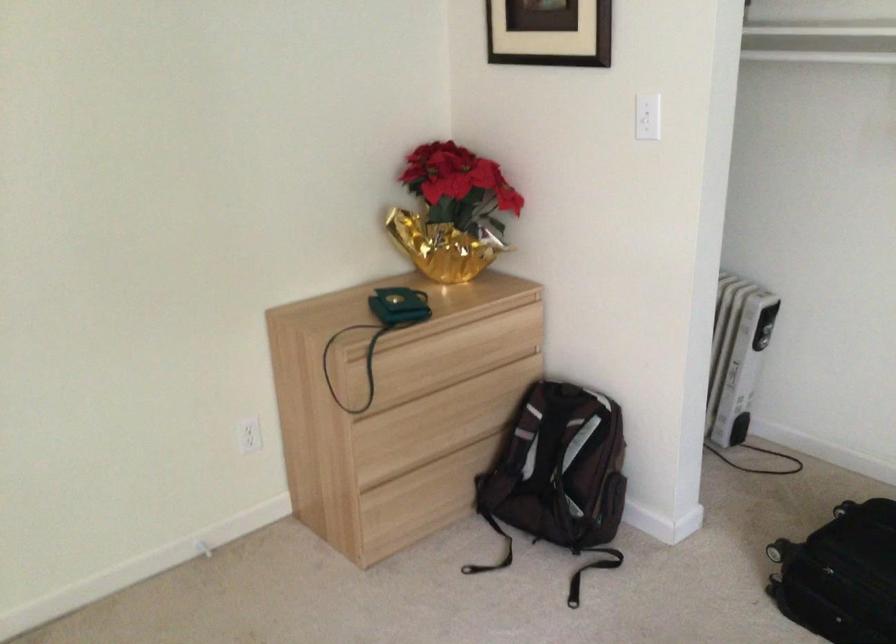
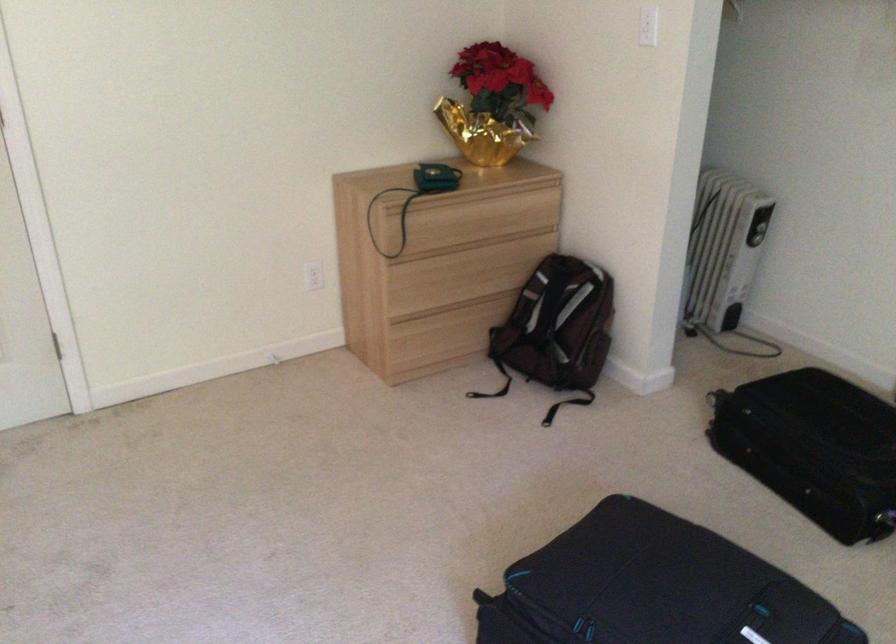
Find the pixel in the second image that matches point (556, 406) in the first image.

(558, 272)